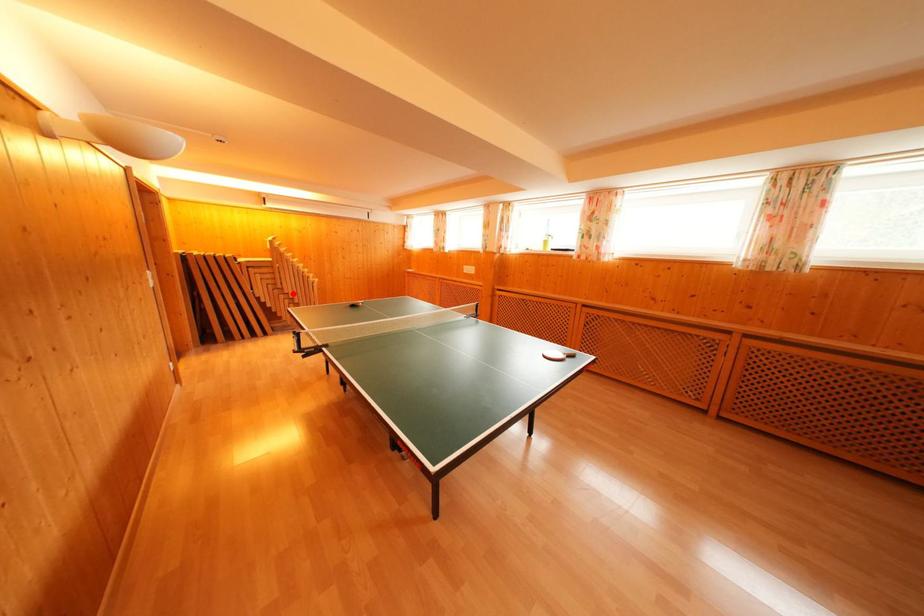
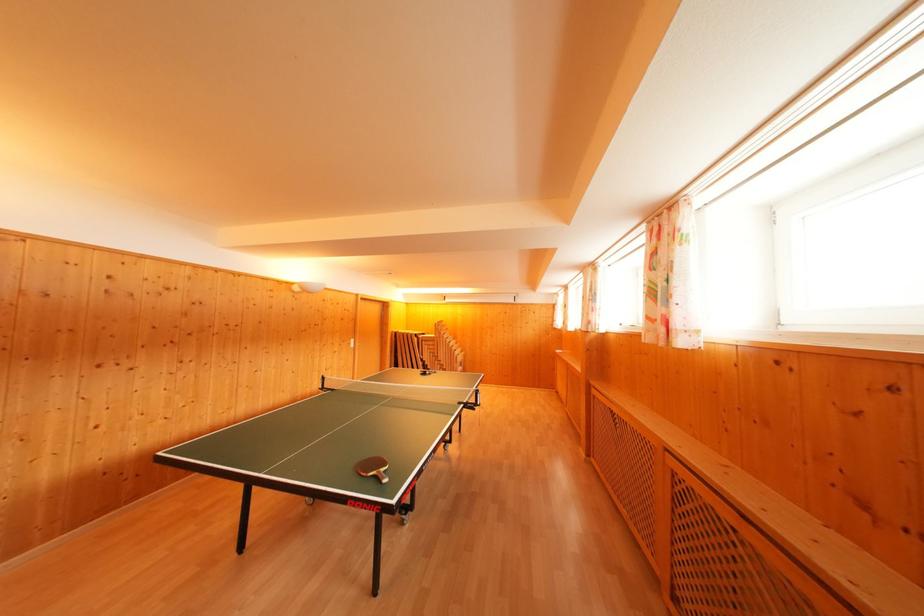
Find the pixel in the second image that matches the highlighted location in the first image.

(445, 362)